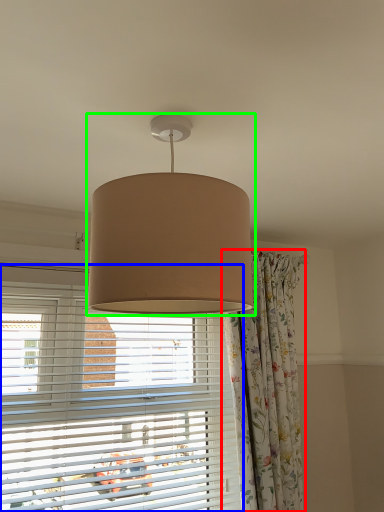
Question: Considering the real-world distances, which object is closest to curtain (highlighted by a red box)? window blind (highlighted by a blue box) or lamp (highlighted by a green box).

Choices:
 (A) window blind
 (B) lamp

Answer: (A)